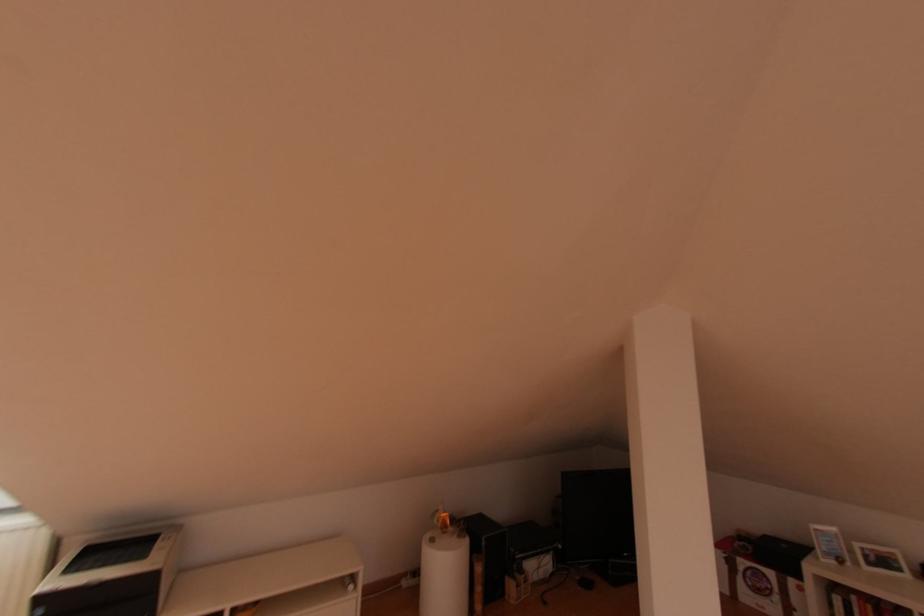
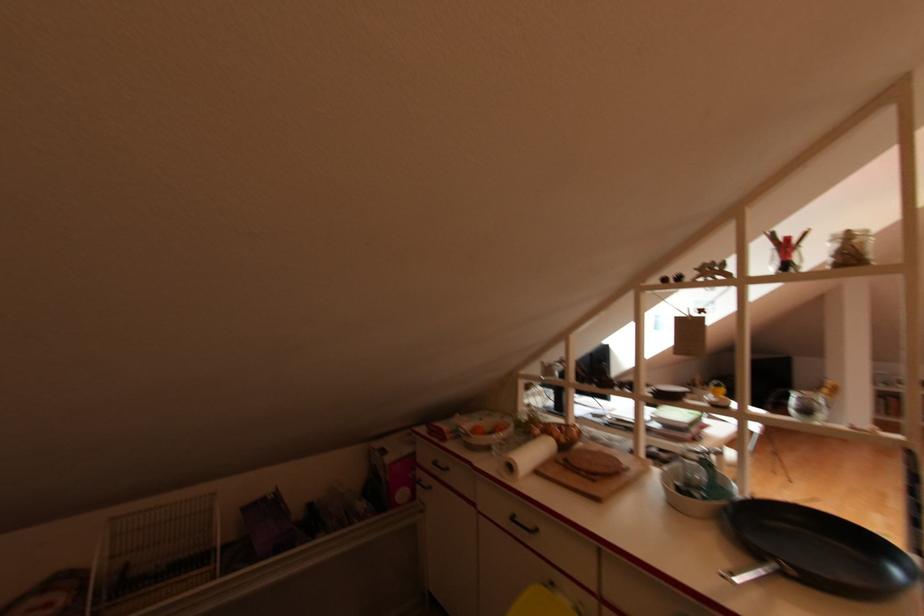
From the picture: Which direction would the cameraman need to move to produce the second image?

The cameraman walked toward left, backward.